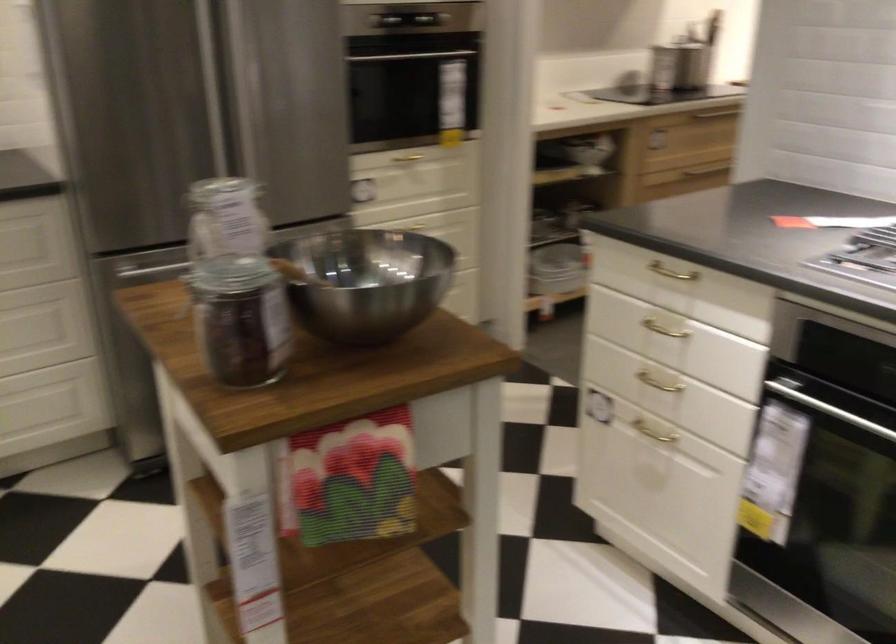
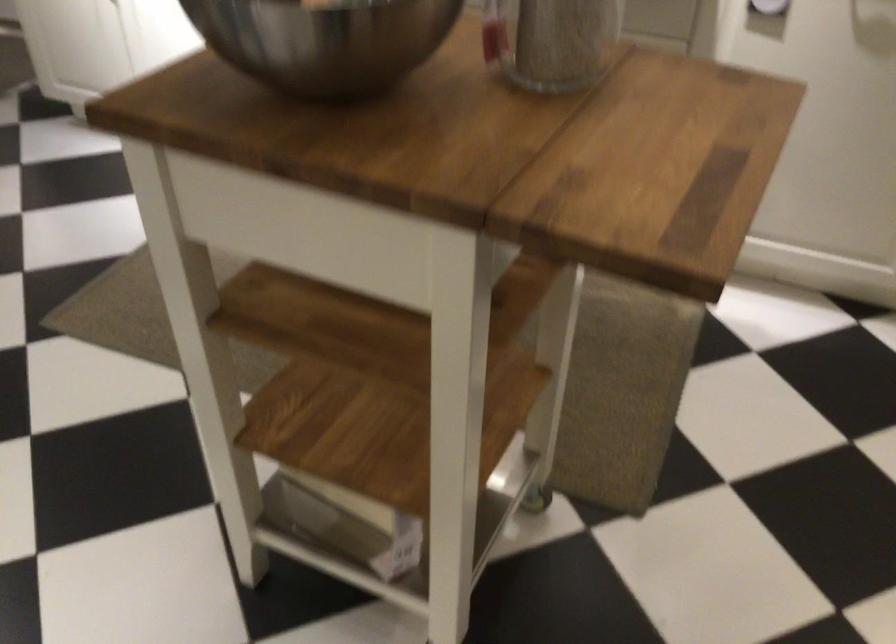
Locate, in the second image, the point that corresponds to (x=381, y=243) in the first image.

(323, 41)